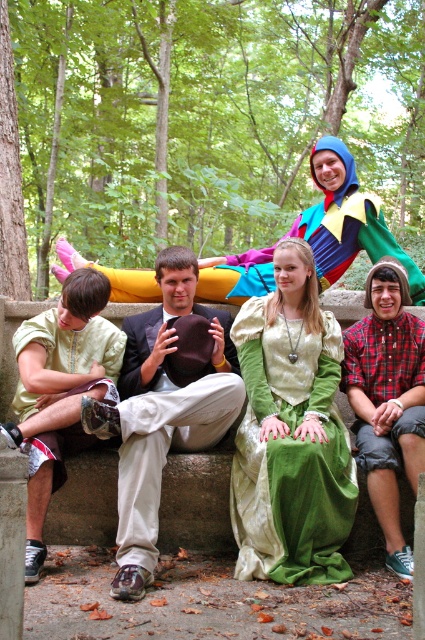
Does point (28, 488) lie in front of point (371, 209)?

Yes, it is in front of point (371, 209).

Who is more forward, (30, 544) or (339, 211)?

Point (30, 544) is more forward.

This screenshot has height=640, width=425. Identify the location of matte gold tunic at left. (59, 390).

Which is in front, point (323, 508) or point (115, 282)?

Point (323, 508)

Which is above, green linen dress at center or multicolored fabric figure at upper center?

multicolored fabric figure at upper center is above.

Does point (241, 433) come in front of point (221, 296)?

Yes.

At what (x,y) coordinates should I click in order to perform the action: click on green linen dress at center. Please return your answer as a coordinate pair (x, y). The height and width of the screenshot is (640, 425). Looking at the image, I should click on click(x=291, y=452).

Is plaid shirt at center behind multicolored fabric figure at upper center?

No, it is in front of multicolored fabric figure at upper center.

Measure the distance between plaid shirt at center and camera.

They are 18.30 feet apart.

Identify the location of plaid shirt at center. This screenshot has height=640, width=425. [388, 397].